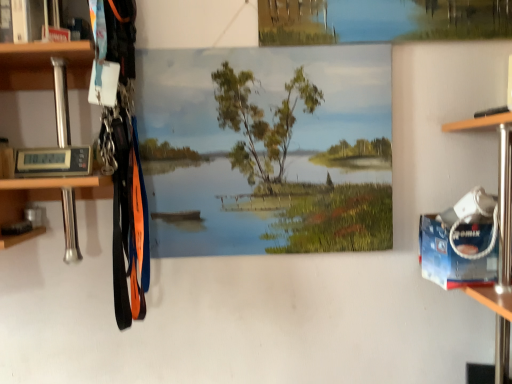
Question: From a real-world perspective, relative to brushed metal cabinet at upper left, is smooth canvas landscape at center vertically above or below?

Choices:
 (A) below
 (B) above

Answer: (A)

Question: From the image's perspective, is smooth canvas landscape at center above or below brushed metal cabinet at upper left?

Choices:
 (A) above
 (B) below

Answer: (B)

Question: Based on their sizes in the image, would you say smooth canvas landscape at center is bigger or smaller than brushed metal cabinet at upper left?

Choices:
 (A) small
 (B) big

Answer: (B)

Question: Considering their positions, is brushed metal cabinet at upper left located in front of or behind smooth canvas landscape at center?

Choices:
 (A) behind
 (B) front

Answer: (B)

Question: Is brushed metal cabinet at upper left inside the boundaries of smooth canvas landscape at center, or outside?

Choices:
 (A) outside
 (B) inside

Answer: (A)

Question: From a real-world perspective, is brushed metal cabinet at upper left positioned above or below smooth canvas landscape at center?

Choices:
 (A) above
 (B) below

Answer: (A)

Question: In terms of height, does brushed metal cabinet at upper left look taller or shorter compared to smooth canvas landscape at center?

Choices:
 (A) tall
 (B) short

Answer: (B)